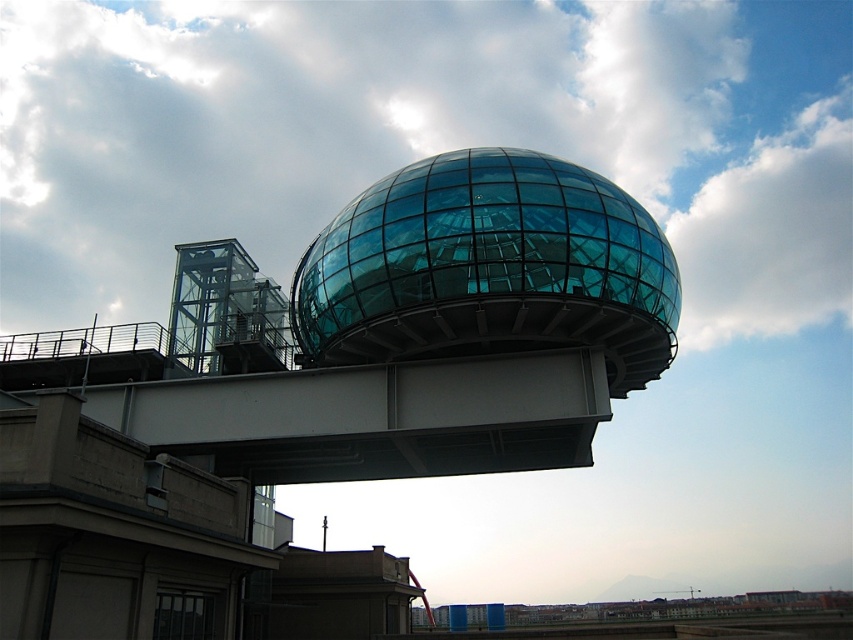
Question: Is transparent glass sphere at center below white metallic overpass at center?

Choices:
 (A) no
 (B) yes

Answer: (A)

Question: Considering the relative positions of transparent glass sphere at center and white metallic overpass at center in the image provided, where is transparent glass sphere at center located with respect to white metallic overpass at center?

Choices:
 (A) above
 (B) below

Answer: (A)

Question: Among these points, which one is nearest to the camera?

Choices:
 (A) (427, 262)
 (B) (209, 433)

Answer: (A)

Question: Can you confirm if transparent glass sphere at center is thinner than white metallic overpass at center?

Choices:
 (A) no
 (B) yes

Answer: (B)